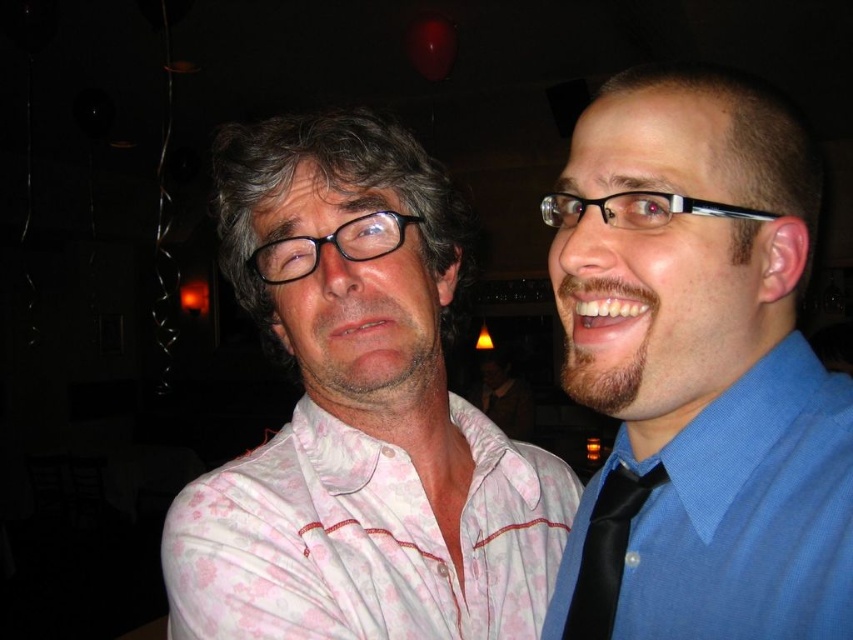
You are at a party and want to know which of the two shirts at the center is taller. The shirts are the white floral shirt at center and the pink floral dress shirt at center. Which one is taller?

The white floral shirt at center is taller than the pink floral dress shirt at center according to the description.

You are organizing a clothing display and need to arrange the blue smooth shirt at right and the pink floral dress shirt at center based on their sizes. Which shirt should be placed first if you want to arrange them from smallest to largest?

The blue smooth shirt at right has a smaller size compared to the pink floral dress shirt at center, so you should place the blue smooth shirt at right first when arranging from smallest to largest.